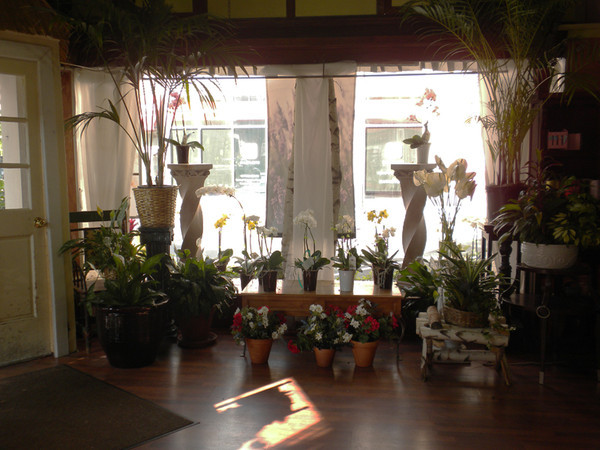
The image size is (600, 450). What are the coordinates of `door` in the screenshot? It's located at (28, 266).